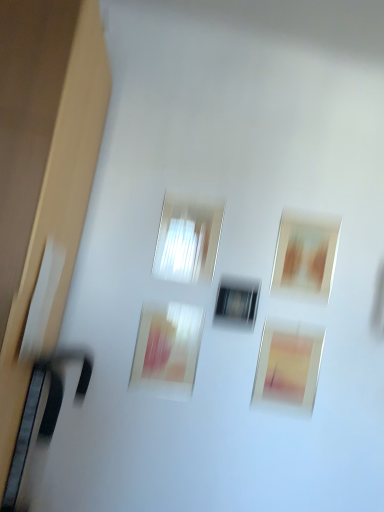
Question: Looking at their shapes, would you say matte brown picture frame at upper right, which ranks as the first picture frame in right-to-left order, is wider or thinner than matte pink painting at center, the first picture frame when ordered from left to right?

Choices:
 (A) thin
 (B) wide

Answer: (A)

Question: Based on their positions, is matte brown picture frame at upper right, the 3th picture frame in the left-to-right sequence, located to the left or right of matte pink painting at center, marked as the 3th picture frame in a right-to-left arrangement?

Choices:
 (A) left
 (B) right

Answer: (B)

Question: Which object is positioned closest to the matte pink picture frame at lower center, which is the second picture frame in right-to-left order?

Choices:
 (A) transparent glass window at center, marked as the second window in a left-to-right arrangement
 (B) matte pink painting at center, the first picture frame when ordered from left to right
 (C) matte brown picture frame at upper right, the 3th picture frame in the left-to-right sequence
 (D) transparent glass window at center, which is the second window in right-to-left order

Answer: (A)

Question: Which object is positioned closest to the transparent glass window at center, positioned as the second window in top-to-bottom order?

Choices:
 (A) matte pink painting at center, marked as the 3th picture frame in a right-to-left arrangement
 (B) matte brown picture frame at upper right, the 3th picture frame in the left-to-right sequence
 (C) matte pink picture frame at lower center, which is the second picture frame in right-to-left order
 (D) transparent glass window at center, which ranks as the first window in left-to-right order

Answer: (D)